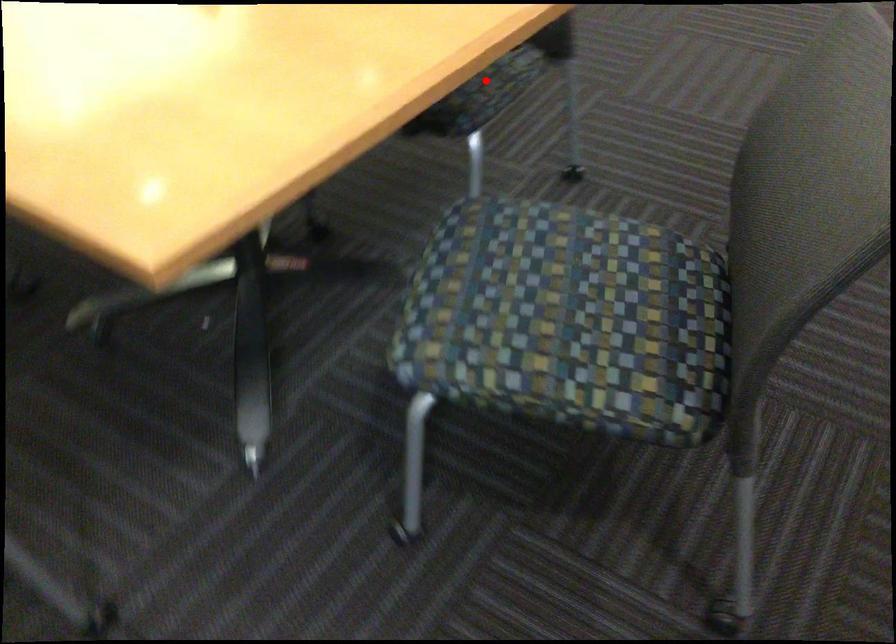
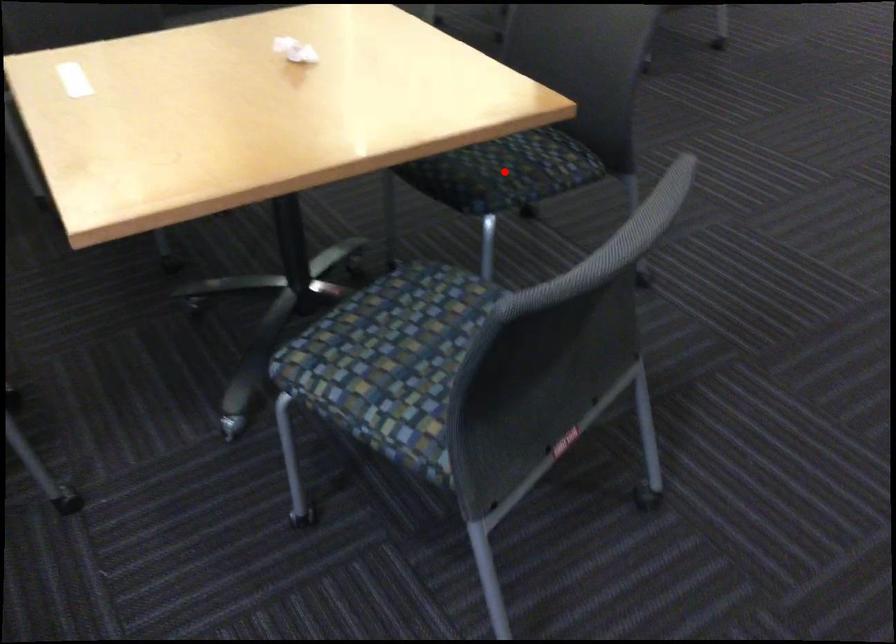
I am providing you with two images of the same scene from different viewpoints. A red point is marked on the first image and another point is marked on the second image. Are the points marked in image1 and image2 representing the same 3D position?

Yes